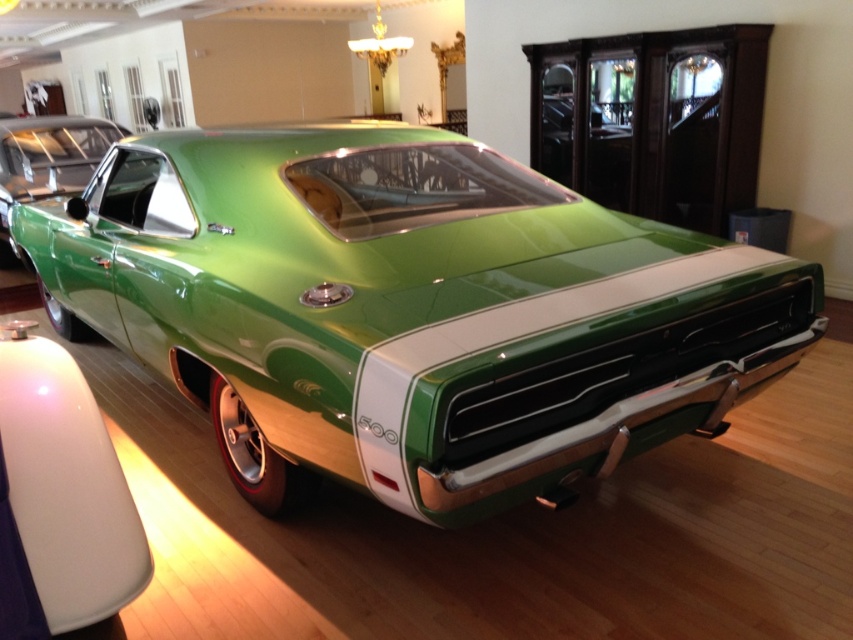
You are a photographer planning to take a photo of the green glossy muscle car at center and the green glossy car at center. Since both cars are green and glossy, you want to highlight their differences in size. Which car should you focus on to emphasize its larger width?

The green glossy muscle car at center has a larger width than the green glossy car at center, so focusing on it will better emphasize its size difference.

You are standing in the showroom and want to take a photo of the car. You notice two points on the car that you want to include in your shot. The first point is at coordinate point (405, 452) and the second is at point (53, 156). Which point will appear larger in your photo?

Point (405, 452) is closer to the camera than point (53, 156), so it will appear larger in the photo.